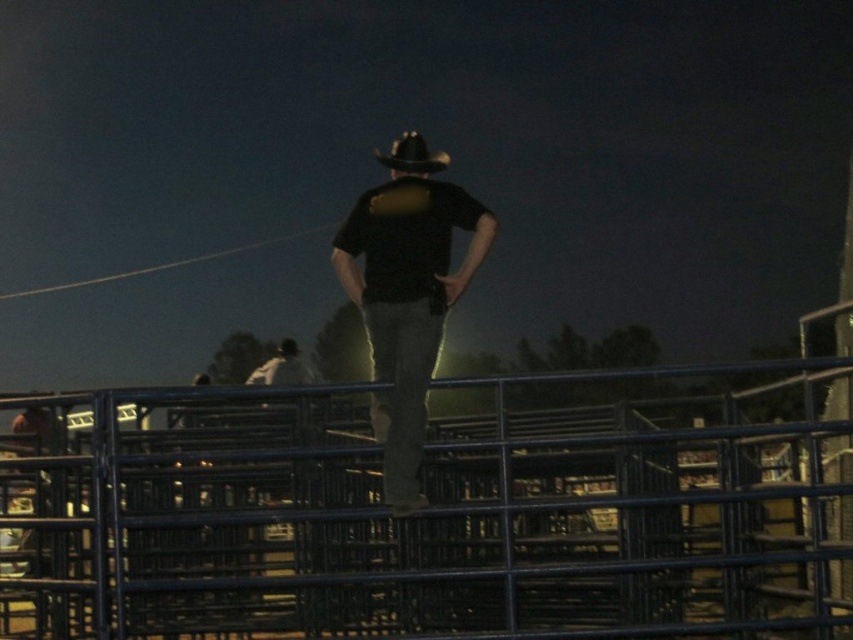
Question: Which object appears farthest from the camera in this image?

Choices:
 (A) black matte cowboy hat at center
 (B) black matte shirt at center
 (C) blue metal fence at center

Answer: (A)

Question: Can you confirm if black matte shirt at center is smaller than black matte cowboy hat at center?

Choices:
 (A) no
 (B) yes

Answer: (B)

Question: Can you confirm if blue metal fence at center is bigger than black matte shirt at center?

Choices:
 (A) yes
 (B) no

Answer: (A)

Question: Which of the following is the farthest from the observer?

Choices:
 (A) (555, 442)
 (B) (396, 464)

Answer: (A)

Question: Based on their relative distances, which object is farther from the black matte shirt at center?

Choices:
 (A) blue metal fence at center
 (B) black matte cowboy hat at center

Answer: (A)

Question: From the image, what is the correct spatial relationship of blue metal fence at center in relation to black matte shirt at center?

Choices:
 (A) left
 (B) right

Answer: (A)